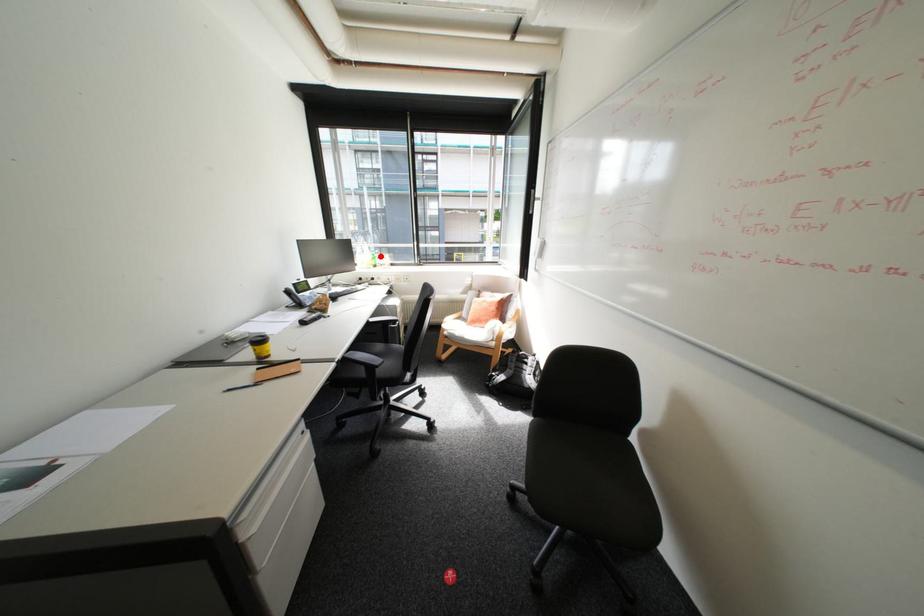
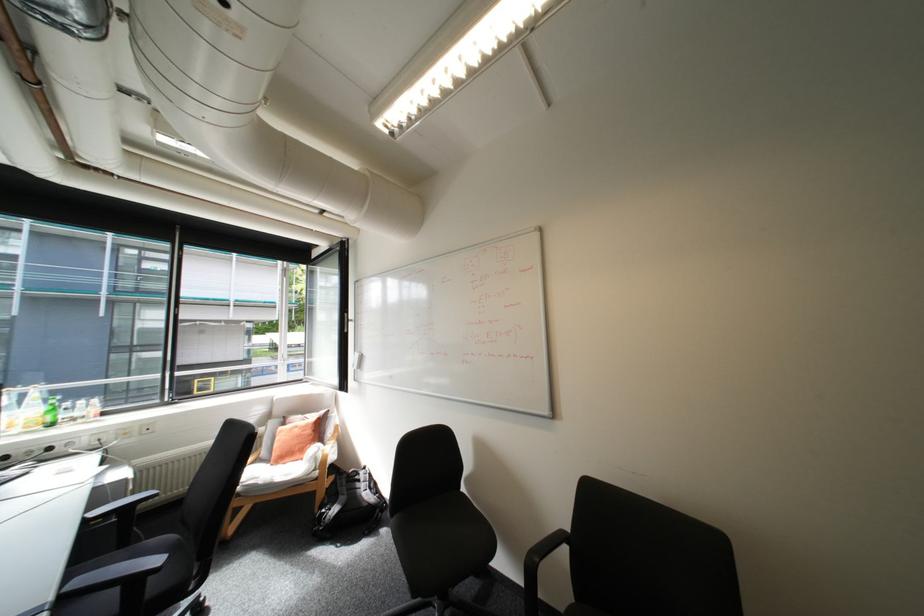
Locate, in the second image, the point that corresponds to the highlighted location in the first image.

(55, 408)